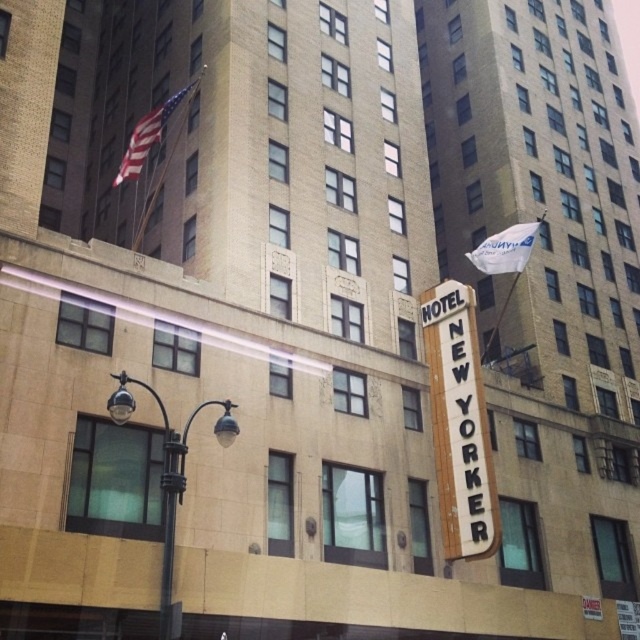
Does white fabric flag at upper right appear on the left side of american flag at upper left?

No, white fabric flag at upper right is not to the left of american flag at upper left.

Measure the distance between white fabric flag at upper right and american flag at upper left.

white fabric flag at upper right and american flag at upper left are 103.53 feet apart.

Which is behind, point (522, 224) or point (148, 144)?

Positioned behind is point (522, 224).

Where is `white fabric flag at upper right`? This screenshot has height=640, width=640. white fabric flag at upper right is located at coordinates tap(504, 250).

From the picture: Who is shorter, white/black sign at center or black metal pole at lower left?

black metal pole at lower left is shorter.

Which is above, white/black sign at center or black metal pole at lower left?

white/black sign at center is higher up.

What do you see at coordinates (460, 422) in the screenshot? I see `white/black sign at center` at bounding box center [460, 422].

Locate an element on the screen. The height and width of the screenshot is (640, 640). white/black sign at center is located at coordinates (460, 422).

Who is more distant from viewer, (x=445, y=545) or (x=136, y=150)?

The point (x=136, y=150) is more distant.

Is the position of white/black sign at center less distant than that of american flag at upper left?

Yes, it is in front of american flag at upper left.

Measure the distance between white/black sign at center and camera.

Result: A distance of 42.68 meters exists between white/black sign at center and camera.

At what (x,y) coordinates should I click in order to perform the action: click on white/black sign at center. Please return your answer as a coordinate pair (x, y). Looking at the image, I should click on (460, 422).